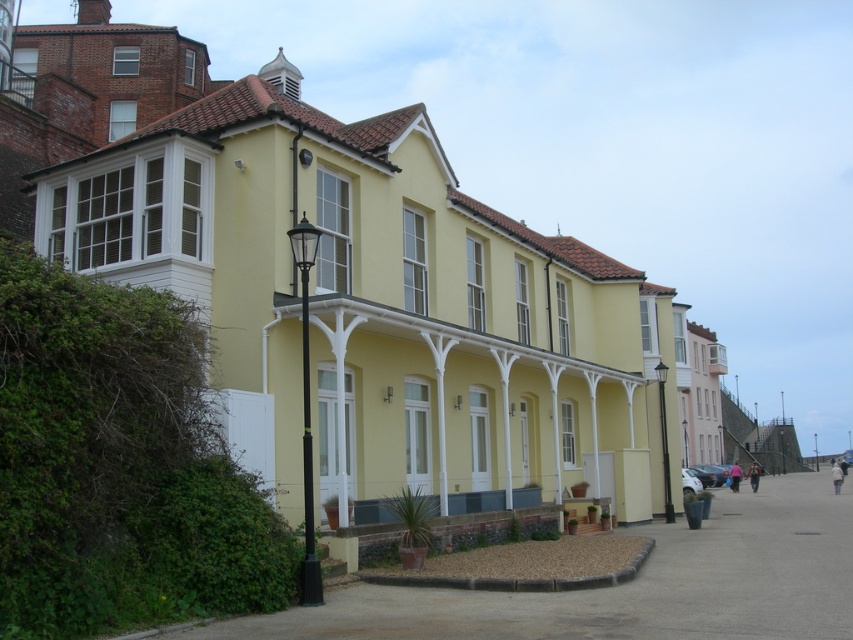
Does black metal/wooden pole at center have a greater width compared to black metal lamp post at center-right?

Indeed, black metal/wooden pole at center has a greater width compared to black metal lamp post at center-right.

Between black metal/wooden pole at center and black metal lamp post at center-right, which one appears on the left side from the viewer's perspective?

Positioned to the left is black metal/wooden pole at center.

Image resolution: width=853 pixels, height=640 pixels. What do you see at coordinates (306, 410) in the screenshot?
I see `black metal/wooden pole at center` at bounding box center [306, 410].

You are a GUI agent. You are given a task and a screenshot of the screen. Output one action in this format:
    pyautogui.click(x=<x>, y=<y>)
    Task: Click on the black metal/wooden pole at center
    The width and height of the screenshot is (853, 640).
    Given the screenshot: What is the action you would take?
    pyautogui.click(x=306, y=410)